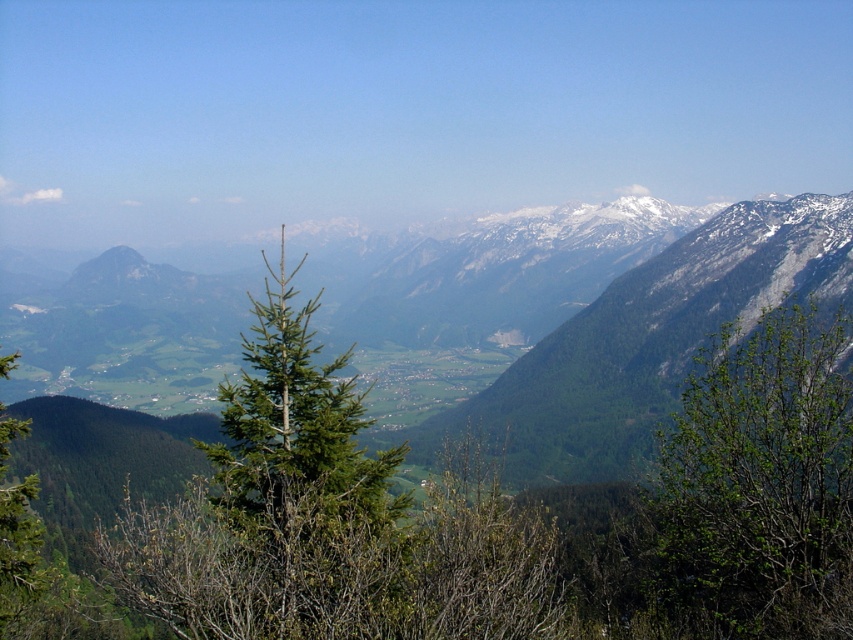
Question: Which point is farther from the camera taking this photo?

Choices:
 (A) (260, 348)
 (B) (691, 580)
 (C) (495, 412)

Answer: (C)

Question: Does green leafy tree at center-right have a greater width compared to green forested mountain range at center?

Choices:
 (A) yes
 (B) no

Answer: (B)

Question: Observing the image, what is the correct spatial positioning of green forested mountain range at center in reference to green needle-like tree at center?

Choices:
 (A) right
 (B) left

Answer: (A)

Question: Is green forested mountain range at center wider than green needle-like tree at center?

Choices:
 (A) no
 (B) yes

Answer: (B)

Question: Which object is positioned closest to the green leafy tree at center-right?

Choices:
 (A) green forested mountain range at center
 (B) green needle-like tree at center

Answer: (B)

Question: Which point is closer to the camera taking this photo?

Choices:
 (A) (321, 444)
 (B) (775, 420)
 (C) (492, 428)

Answer: (A)